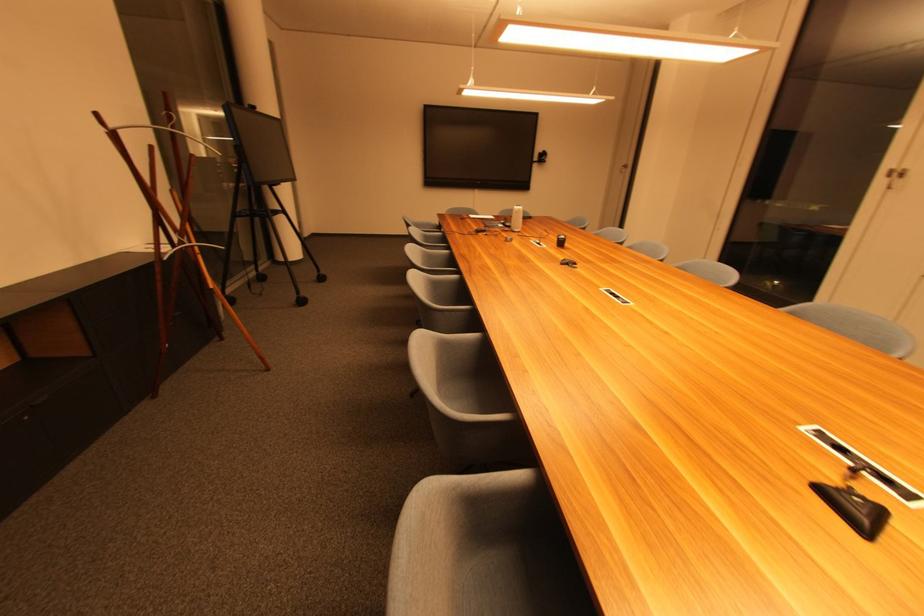
Where would you turn the door handle? Please return your answer as a coordinate pair (x, y).

(894, 176)